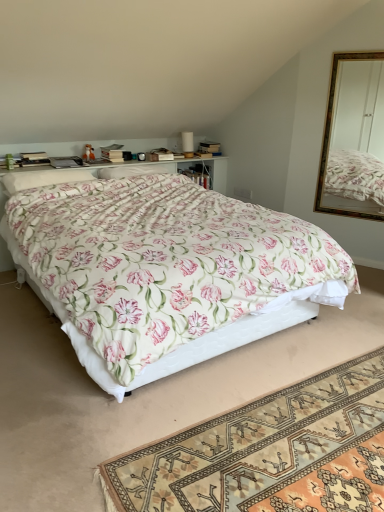
Find the location of a particular element. empty space that is in between floral fabric bed at center and floral fabric rug at lower center is located at coordinates (158, 426).